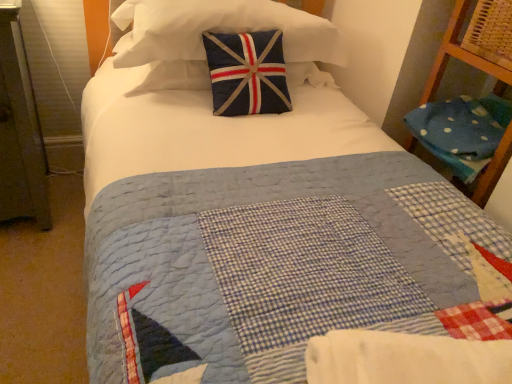
Question: Is navy blue fabric pillow at upper center, the second pillow when ordered from right to left, wider or thinner than white cotton blanket at center?

Choices:
 (A) wide
 (B) thin

Answer: (A)

Question: Considering the positions of navy blue fabric pillow at upper center, which is the 1th pillow from top to bottom, and white cotton blanket at center in the image, is navy blue fabric pillow at upper center, which is the 1th pillow from top to bottom, bigger or smaller than white cotton blanket at center?

Choices:
 (A) small
 (B) big

Answer: (B)

Question: Estimate the real-world distances between objects in this image. Which object is closer to the blue polka dot fabric at right, positioned as the 2th pillow in top-to-bottom order?

Choices:
 (A) white cotton blanket at center
 (B) navy blue fabric pillow at upper center, acting as the first pillow starting from the left

Answer: (B)

Question: Estimate the real-world distances between objects in this image. Which object is closer to the blue polka dot fabric at right, the 1th pillow from the bottom?

Choices:
 (A) white cotton blanket at center
 (B) navy blue fabric pillow at upper center, the second pillow when ordered from right to left

Answer: (B)